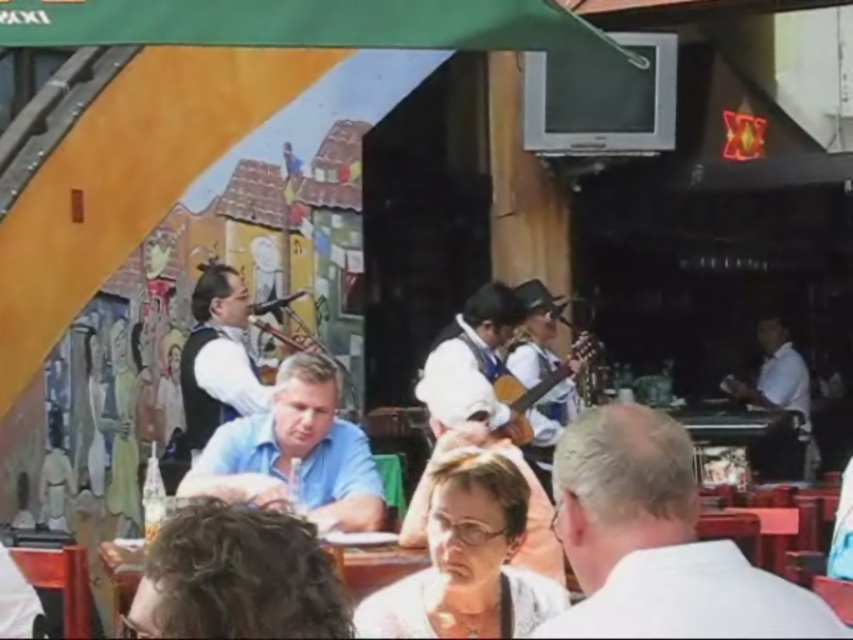
Between point (222, 372) and point (807, 451), which one is positioned in front?

Point (222, 372) is more forward.

Locate an element on the screen. This screenshot has height=640, width=853. white fabric shirt at center is located at coordinates (218, 355).

Is white matte shirt at center to the right of white smooth shirt at right from the viewer's perspective?

In fact, white matte shirt at center is to the left of white smooth shirt at right.

Is point (614, 500) more distant than point (769, 372)?

No, (614, 500) is closer to viewer.

Between point (721, 576) and point (776, 403), which one is positioned behind?

The point (776, 403) is more distant.

What are the coordinates of `white matte shirt at center` in the screenshot? It's located at (657, 541).

Is white fabric shirt at center below wooden acoustic guitar at center?

Correct, white fabric shirt at center is located below wooden acoustic guitar at center.

Does white fabric shirt at center appear over wooden acoustic guitar at center?

No.

Who is more distant from viewer, (x=207, y=266) or (x=512, y=426)?

Point (x=207, y=266)

Image resolution: width=853 pixels, height=640 pixels. Find the location of `white fabric shirt at center`. white fabric shirt at center is located at coordinates (218, 355).